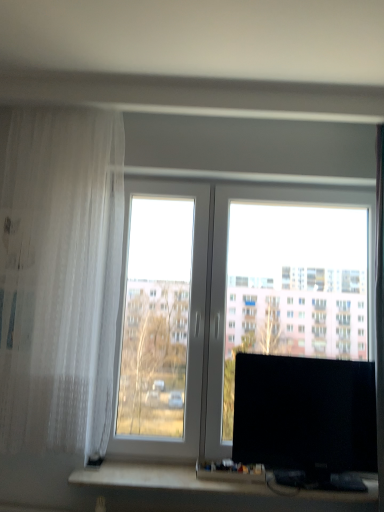
Question: Is there a large distance between white sheer curtain at left and black glossy monitor at right?

Choices:
 (A) yes
 (B) no

Answer: (B)

Question: Is white sheer curtain at left to the left of black glossy monitor at right from the viewer's perspective?

Choices:
 (A) yes
 (B) no

Answer: (A)

Question: Is black glossy monitor at right at the back of white sheer curtain at left?

Choices:
 (A) no
 (B) yes

Answer: (A)

Question: Is white sheer curtain at left outside black glossy monitor at right?

Choices:
 (A) yes
 (B) no

Answer: (A)

Question: Considering the relative sizes of white sheer curtain at left and black glossy monitor at right in the image provided, is white sheer curtain at left smaller than black glossy monitor at right?

Choices:
 (A) yes
 (B) no

Answer: (B)

Question: Considering the positions of black glossy monitor at right and transparent glass window at center in the image, is black glossy monitor at right wider or thinner than transparent glass window at center?

Choices:
 (A) thin
 (B) wide

Answer: (B)

Question: From a real-world perspective, relative to transparent glass window at center, is black glossy monitor at right vertically above or below?

Choices:
 (A) above
 (B) below

Answer: (B)

Question: Visually, is black glossy monitor at right positioned to the left or to the right of transparent glass window at center?

Choices:
 (A) left
 (B) right

Answer: (B)

Question: Considering the positions of black glossy monitor at right and transparent glass window at center in the image, is black glossy monitor at right taller or shorter than transparent glass window at center?

Choices:
 (A) short
 (B) tall

Answer: (A)

Question: Is black plastic computer desk at lower center in front of or behind white sheer curtain at left in the image?

Choices:
 (A) front
 (B) behind

Answer: (B)

Question: From the image's perspective, is black plastic computer desk at lower center located above or below white sheer curtain at left?

Choices:
 (A) above
 (B) below

Answer: (B)

Question: Does point (162, 483) appear closer or farther from the camera than point (13, 244)?

Choices:
 (A) closer
 (B) farther

Answer: (A)

Question: In terms of width, does black plastic computer desk at lower center look wider or thinner when compared to white sheer curtain at left?

Choices:
 (A) thin
 (B) wide

Answer: (A)

Question: From a real-world perspective, is black plastic computer desk at lower center above or below transparent glass window at center?

Choices:
 (A) below
 (B) above

Answer: (A)

Question: In the image, is black plastic computer desk at lower center on the left side or the right side of transparent glass window at center?

Choices:
 (A) left
 (B) right

Answer: (A)